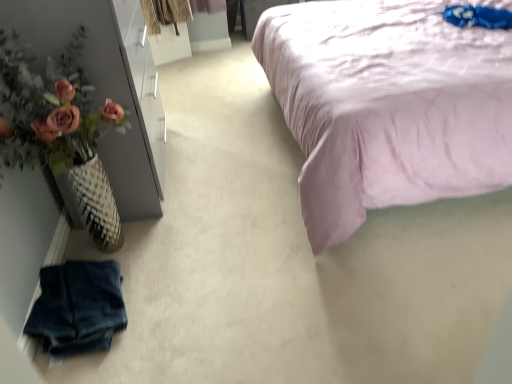
Question: Is faded denim shorts at lower left not inside matte pink flowers at left?

Choices:
 (A) yes
 (B) no

Answer: (A)

Question: Does faded denim shorts at lower left appear on the right side of matte pink flowers at left?

Choices:
 (A) yes
 (B) no

Answer: (A)

Question: Is faded denim shorts at lower left smaller than matte pink flowers at left?

Choices:
 (A) yes
 (B) no

Answer: (A)

Question: Can you confirm if faded denim shorts at lower left is wider than matte pink flowers at left?

Choices:
 (A) yes
 (B) no

Answer: (B)

Question: Is there a large distance between faded denim shorts at lower left and matte pink flowers at left?

Choices:
 (A) no
 (B) yes

Answer: (A)

Question: Choose the correct answer: Is faded denim shorts at lower left inside matte pink flowers at left or outside it?

Choices:
 (A) outside
 (B) inside

Answer: (A)

Question: Is point (103, 347) positioned closer to the camera than point (94, 115)?

Choices:
 (A) farther
 (B) closer

Answer: (B)

Question: Would you say faded denim shorts at lower left is to the left or to the right of matte pink flowers at left in the picture?

Choices:
 (A) left
 (B) right

Answer: (B)

Question: From a real-world perspective, is faded denim shorts at lower left positioned above or below matte pink flowers at left?

Choices:
 (A) above
 (B) below

Answer: (B)

Question: From the image's perspective, relative to faded denim shorts at lower left, is matte pink flowers at left above or below?

Choices:
 (A) below
 (B) above

Answer: (B)

Question: Is point (30, 72) positioned closer to the camera than point (83, 347)?

Choices:
 (A) farther
 (B) closer

Answer: (A)

Question: Is matte pink flowers at left in front of or behind faded denim shorts at lower left in the image?

Choices:
 (A) behind
 (B) front

Answer: (A)

Question: From a real-world perspective, is matte pink flowers at left positioned above or below faded denim shorts at lower left?

Choices:
 (A) above
 (B) below

Answer: (A)

Question: Which is correct: faded denim shorts at lower left is inside lavender satin bed at upper right, or outside of it?

Choices:
 (A) inside
 (B) outside

Answer: (B)

Question: In the image, is faded denim shorts at lower left on the left side or the right side of lavender satin bed at upper right?

Choices:
 (A) right
 (B) left

Answer: (B)